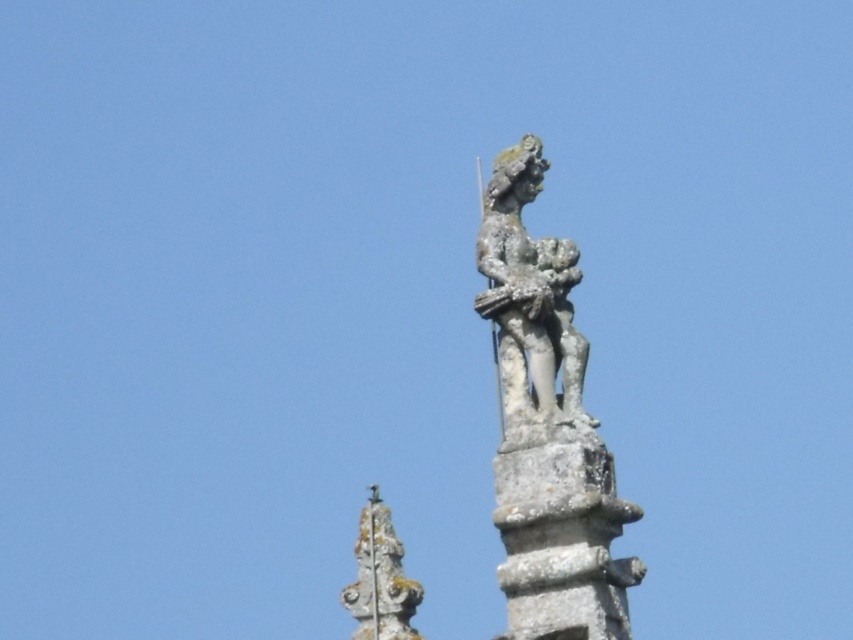
Is point (524, 410) in front of point (370, 608)?

Yes, it is in front of point (370, 608).

Does point (537, 330) come farther from viewer compared to point (418, 636)?

No, it is in front of (418, 636).

You are a GUI agent. You are given a task and a screenshot of the screen. Output one action in this format:
    pyautogui.click(x=<x>, y=<y>)
    Task: Click on the rusty stone statue at upper center
    
    Given the screenshot: What is the action you would take?
    pyautogui.click(x=531, y=291)